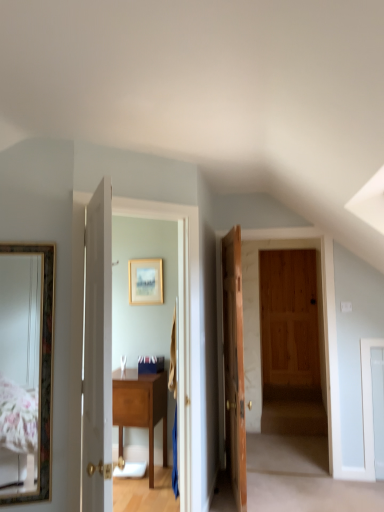
Locate an element on the screen. gold-framed mirror at left is located at coordinates (41, 370).

Identify the location of gold-framed picture at center. Image resolution: width=384 pixels, height=512 pixels. (145, 281).

Is wooden door at center, which ranks as the second door in left-to-right order, oriented away from gold-framed picture at center?

Yes, wooden door at center, which ranks as the second door in left-to-right order, is positioned with its back facing gold-framed picture at center.

Is point (225, 308) closer to camera compared to point (141, 268)?

Yes, it is in front of point (141, 268).

How distant is wooden door at center, which appears as the first door when viewed from the back, from gold-framed picture at center?

wooden door at center, which appears as the first door when viewed from the back, and gold-framed picture at center are 33.25 inches apart from each other.

What are the coordinates of `mirror lying in front of the gold-framed picture at center` in the screenshot? It's located at (41, 370).

Is gold-framed picture at center behind gold-framed mirror at left?

Yes, the depth of gold-framed picture at center is greater than that of gold-framed mirror at left.

Which is behind, point (151, 265) or point (50, 499)?

Point (151, 265)

From the image's perspective, is gold-framed picture at center on top of gold-framed mirror at left?

Indeed, from the image's perspective, gold-framed picture at center is shown above gold-framed mirror at left.

Can you confirm if gold-framed mirror at left is positioned to the right of white wooden door at center, which is counted as the 1th door, starting from the front?

No, gold-framed mirror at left is not to the right of white wooden door at center, which is counted as the 1th door, starting from the front.

How much distance is there between gold-framed mirror at left and white wooden door at center, which is counted as the 1th door, starting from the front?

A distance of 19.71 inches exists between gold-framed mirror at left and white wooden door at center, which is counted as the 1th door, starting from the front.

Which is closer to the camera, (18, 243) or (99, 287)?

The point (99, 287) is closer.

Locate an element on the screen. The height and width of the screenshot is (512, 384). table beneath the gold-framed mirror at left (from a real-world perspective) is located at coordinates (140, 408).

Is wooden table at center situated inside gold-framed mirror at left or outside?

wooden table at center cannot be found inside gold-framed mirror at left.

Considering the positions of objects wooden table at center and gold-framed mirror at left in the image provided, who is more to the right, wooden table at center or gold-framed mirror at left?

Positioned to the right is wooden table at center.

Which object is further away from the camera, wooden table at center or gold-framed mirror at left?

wooden table at center is behind.

There is a gold-framed mirror at left. At what (x,y) coordinates should I click in order to perform the action: click on picture frame above it (from a real-world perspective). Please return your answer as a coordinate pair (x, y). The image size is (384, 512). Looking at the image, I should click on (145, 281).

Which object is positioned more to the right, gold-framed mirror at left or gold-framed picture at center?

From the viewer's perspective, gold-framed picture at center appears more on the right side.

Is gold-framed mirror at left facing away from gold-framed picture at center?

gold-framed mirror at left is not turned away from gold-framed picture at center.

Can you see gold-framed mirror at left touching gold-framed picture at center?

There is a gap between gold-framed mirror at left and gold-framed picture at center.

Which is more distant, (144, 386) or (110, 362)?

The point (144, 386) is behind.

In the image, is wooden table at center positioned in front of or behind white wooden door at center, which is counted as the 1th door, starting from the front?

In the image, wooden table at center appears behind white wooden door at center, which is counted as the 1th door, starting from the front.

Is wooden table at center looking in the opposite direction of white wooden door at center, positioned as the 2th door in right-to-left order?

wooden table at center is not turned away from white wooden door at center, positioned as the 2th door in right-to-left order.

Does wooden table at center have a lesser height compared to white wooden door at center, which is the second door from back to front?

Yes.

Is wooden door at center, which appears as the first door when viewed from the back, at the right side of gold-framed mirror at left?

Yes.

From a real-world perspective, is wooden door at center, which ranks as the second door in left-to-right order, physically located above or below gold-framed mirror at left?

wooden door at center, which ranks as the second door in left-to-right order, is situated lower than gold-framed mirror at left in the real world.

Where is `door that is under the gold-framed mirror at left (from a real-world perspective)`? This screenshot has width=384, height=512. door that is under the gold-framed mirror at left (from a real-world perspective) is located at coordinates (234, 365).

From the picture: Considering the sizes of objects wooden door at center, which appears as the second door when viewed from the front, and gold-framed mirror at left in the image provided, who is shorter, wooden door at center, which appears as the second door when viewed from the front, or gold-framed mirror at left?

gold-framed mirror at left is shorter.

The height and width of the screenshot is (512, 384). I want to click on picture frame above the wooden door at center, which appears as the second door when viewed from the front (from a real-world perspective), so click(x=145, y=281).

Find the location of a particular element. The height and width of the screenshot is (512, 384). mirror that is in front of the gold-framed picture at center is located at coordinates (41, 370).

When comparing their distances from gold-framed picture at center, does wooden table at center or white wooden door at center, which is the second door from back to front, seem closer?

wooden table at center.

From the image, which object appears to be nearer to gold-framed picture at center, gold-framed mirror at left or wooden table at center?

wooden table at center is closer to gold-framed picture at center.

Based on the photo, looking at the image, which one is located further to gold-framed mirror at left, wooden table at center or white wooden door at center, which is counted as the 1th door, starting from the front?

Among the two, wooden table at center is located further to gold-framed mirror at left.

Based on their spatial positions, is white wooden door at center, positioned as the 2th door in right-to-left order, or wooden door at center, which ranks as the second door in left-to-right order, further from gold-framed mirror at left?

Result: wooden door at center, which ranks as the second door in left-to-right order, lies further to gold-framed mirror at left than the other object.

Which object lies nearer to the anchor point gold-framed picture at center, wooden door at center, which appears as the first door when viewed from the back, or gold-framed mirror at left?

wooden door at center, which appears as the first door when viewed from the back.

Based on their spatial positions, is wooden door at center, which appears as the first door when viewed from the back, or gold-framed mirror at left further from white wooden door at center, which ranks as the first door in left-to-right order?

Among the two, wooden door at center, which appears as the first door when viewed from the back, is located further to white wooden door at center, which ranks as the first door in left-to-right order.

Considering their positions, is gold-framed picture at center positioned further to wooden table at center than gold-framed mirror at left?

The object further to wooden table at center is gold-framed mirror at left.

Looking at the image, which one is located closer to gold-framed picture at center, wooden door at center, arranged as the first door when viewed from the right, or wooden table at center?

Based on the image, wooden door at center, arranged as the first door when viewed from the right, appears to be nearer to gold-framed picture at center.

The height and width of the screenshot is (512, 384). I want to click on table between white wooden door at center, positioned as the 2th door in right-to-left order, and gold-framed picture at center in the front-back direction, so click(140, 408).

The width and height of the screenshot is (384, 512). Identify the location of door between gold-framed mirror at left and gold-framed picture at center from front to back. (234, 365).

Find the location of a particular element. The image size is (384, 512). door located between white wooden door at center, which is counted as the 1th door, starting from the front, and wooden table at center in the depth direction is located at coordinates (234, 365).

Locate an element on the screen. The width and height of the screenshot is (384, 512). table between gold-framed mirror at left and wooden door at center, which ranks as the second door in left-to-right order, in the horizontal direction is located at coordinates (140, 408).